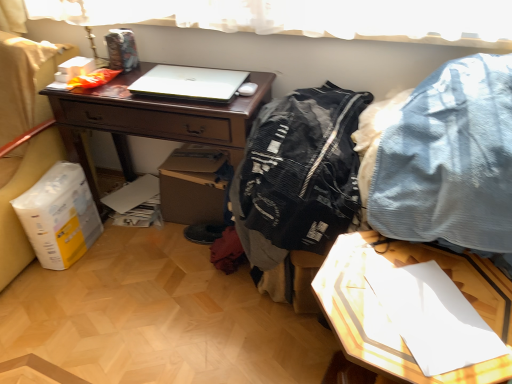
Question: Considering the relative sizes of black mesh jacket at center, which is counted as the 2th clothing, starting from the right, and denim fabric pants at upper right, the first clothing when ordered from right to left, in the image provided, is black mesh jacket at center, which is counted as the 2th clothing, starting from the right, bigger than denim fabric pants at upper right, the first clothing when ordered from right to left,?

Choices:
 (A) yes
 (B) no

Answer: (B)

Question: Is black mesh jacket at center, the 1th clothing when ordered from left to right, facing away from denim fabric pants at upper right, acting as the 2th clothing starting from the left?

Choices:
 (A) no
 (B) yes

Answer: (A)

Question: Can you confirm if black mesh jacket at center, which is counted as the 2th clothing, starting from the right, is shorter than denim fabric pants at upper right, acting as the 2th clothing starting from the left?

Choices:
 (A) yes
 (B) no

Answer: (B)

Question: From the image's perspective, is black mesh jacket at center, the 1th clothing when ordered from left to right, located above denim fabric pants at upper right, acting as the 2th clothing starting from the left?

Choices:
 (A) no
 (B) yes

Answer: (A)

Question: Can denim fabric pants at upper right, the first clothing when ordered from right to left, be found inside black mesh jacket at center, the 1th clothing when ordered from left to right?

Choices:
 (A) no
 (B) yes

Answer: (A)

Question: Is point (263, 193) closer or farther from the camera than point (327, 286)?

Choices:
 (A) closer
 (B) farther

Answer: (B)

Question: Based on their sizes in the image, would you say black mesh jacket at center, the 1th clothing when ordered from left to right, is bigger or smaller than white glossy paper at lower right?

Choices:
 (A) small
 (B) big

Answer: (A)

Question: Considering their positions, is black mesh jacket at center, the 1th clothing when ordered from left to right, located in front of or behind white glossy paper at lower right?

Choices:
 (A) front
 (B) behind

Answer: (B)

Question: Is black mesh jacket at center, the 1th clothing when ordered from left to right, inside the boundaries of white glossy paper at lower right, or outside?

Choices:
 (A) inside
 (B) outside

Answer: (B)

Question: Is matte brown desk at center taller or shorter than black mesh jacket at center, the 1th clothing when ordered from left to right?

Choices:
 (A) short
 (B) tall

Answer: (B)

Question: Considering their positions, is matte brown desk at center located in front of or behind black mesh jacket at center, the 1th clothing when ordered from left to right?

Choices:
 (A) behind
 (B) front

Answer: (A)

Question: Would you say matte brown desk at center is to the left or to the right of black mesh jacket at center, which is counted as the 2th clothing, starting from the right, in the picture?

Choices:
 (A) right
 (B) left

Answer: (B)

Question: Looking at their shapes, would you say matte brown desk at center is wider or thinner than black mesh jacket at center, which is counted as the 2th clothing, starting from the right?

Choices:
 (A) wide
 (B) thin

Answer: (B)

Question: Is white glossy paper at lower right bigger or smaller than denim fabric pants at upper right, acting as the 2th clothing starting from the left?

Choices:
 (A) small
 (B) big

Answer: (A)

Question: In the image, is white glossy paper at lower right positioned in front of or behind denim fabric pants at upper right, the first clothing when ordered from right to left?

Choices:
 (A) front
 (B) behind

Answer: (A)